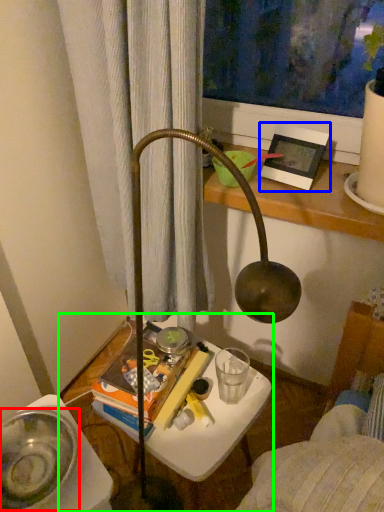
Question: Which object is the farthest from glass bowl (highlighted by a red box)? Choose among these: picture frame (highlighted by a blue box) or table (highlighted by a green box).

Choices:
 (A) picture frame
 (B) table

Answer: (A)